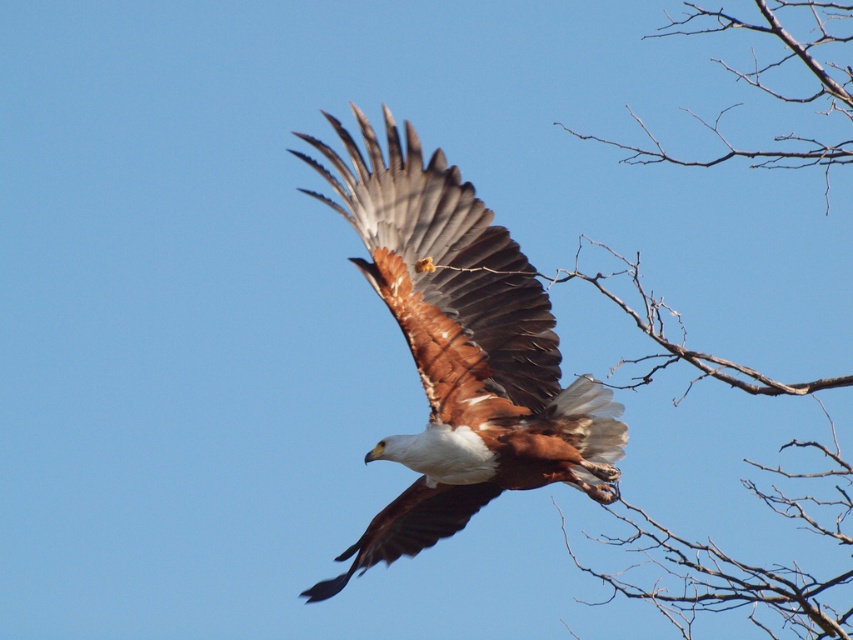
Question: Among these objects, which one is farthest from the camera?

Choices:
 (A) bare wood at upper right
 (B) brown feathered eagle at center

Answer: (A)

Question: Which object appears closest to the camera in this image?

Choices:
 (A) bare wood at upper right
 (B) bare branches at right
 (C) brown feathered eagle at center

Answer: (B)

Question: Where is brown feathered eagle at center located in relation to bare branches at right in the image?

Choices:
 (A) below
 (B) above

Answer: (A)

Question: Does brown feathered eagle at center appear on the left side of bare branches at right?

Choices:
 (A) no
 (B) yes

Answer: (B)

Question: Among these objects, which one is farthest from the camera?

Choices:
 (A) brown feathered eagle at center
 (B) bare wood at upper right
 (C) bare branches at right

Answer: (B)

Question: In this image, where is brown feathered eagle at center located relative to bare branches at right?

Choices:
 (A) below
 (B) above

Answer: (A)